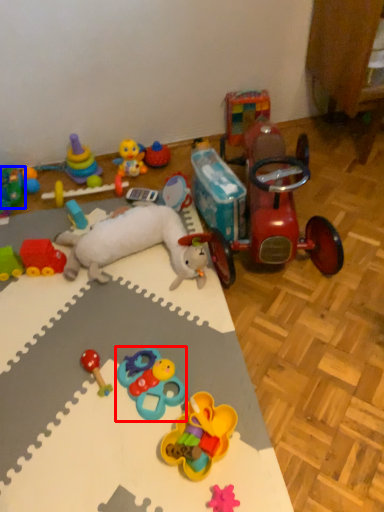
Question: Which point is further to the camera, toy (highlighted by a red box) or toy (highlighted by a blue box)?

Choices:
 (A) toy
 (B) toy

Answer: (B)